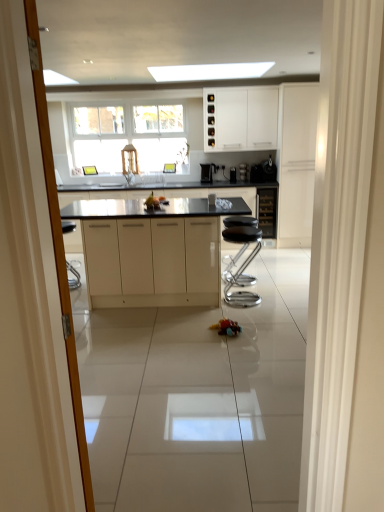
This screenshot has width=384, height=512. Identify the location of rubberized plastic toy car at center. (227, 327).

Identify the location of satin black coffee machine at center, which is the 1th coffee machine from left to right. The image size is (384, 512). (208, 172).

What do you see at coordinates (269, 170) in the screenshot? This screenshot has width=384, height=512. I see `satin black coffee machine at upper right, the third appliance positioned from the left` at bounding box center [269, 170].

Where is `metallic silver coffee machine at center, marked as the third appliance in a right-to-left arrangement`? The height and width of the screenshot is (512, 384). metallic silver coffee machine at center, marked as the third appliance in a right-to-left arrangement is located at coordinates (233, 174).

In order to face metallic silver coffee machine at center, marked as the third appliance in a right-to-left arrangement, should I rotate leftwards or rightwards?

You should look right and rotate roughly 5.714 degrees.

Measure the distance between point (248, 297) and camera.

Point (248, 297) is 13.45 feet from camera.

Measure the distance between black granite countertop at center and camera.

5.65 meters.

The height and width of the screenshot is (512, 384). Find the location of `rubberized plastic toy car at center`. rubberized plastic toy car at center is located at coordinates (227, 327).

Which is nearer, (264, 170) or (224, 231)?

Clearly, point (264, 170) is more distant from the camera than point (224, 231).

From a real-world perspective, is satin black coffee machine at upper right, which appears as the 1th appliance when viewed from the right, physically located above or below black leather stool at center?

Clearly, from a real-world perspective, satin black coffee machine at upper right, which appears as the 1th appliance when viewed from the right, is above black leather stool at center.

Is satin black coffee machine at upper right, the third appliance positioned from the left, with black leather stool at center?

No, satin black coffee machine at upper right, the third appliance positioned from the left, is not in contact with black leather stool at center.

Identify the location of bar stool below the satin black coffee machine at upper right, the third appliance positioned from the left (from the image's perspective). (241, 265).

Is black granite countertop at center not inside matte black cabinet at center, placed as the second cabinetry when sorted from left to right?

Indeed, black granite countertop at center is completely outside matte black cabinet at center, placed as the second cabinetry when sorted from left to right.

From a real-world perspective, between black granite countertop at center and matte black cabinet at center, positioned as the 2th cabinetry in right-to-left order, who is vertically higher?

matte black cabinet at center, positioned as the 2th cabinetry in right-to-left order.

From the image's perspective, is black granite countertop at center beneath matte black cabinet at center, positioned as the 2th cabinetry in right-to-left order?

Yes, from the image's perspective, black granite countertop at center is below matte black cabinet at center, positioned as the 2th cabinetry in right-to-left order.

How far apart are black granite countertop at center and matte black cabinet at center, placed as the second cabinetry when sorted from left to right?

A distance of 25.27 inches exists between black granite countertop at center and matte black cabinet at center, placed as the second cabinetry when sorted from left to right.

Is white matte cabinet at upper center, acting as the 3th cabinetry starting from the right, looking in the opposite direction of rubberized plastic toy car at center?

No, white matte cabinet at upper center, acting as the 3th cabinetry starting from the right, is not facing the opposite direction of rubberized plastic toy car at center.

Is white matte cabinet at upper center, arranged as the first cabinetry when viewed from the left, bigger or smaller than rubberized plastic toy car at center?

Clearly, white matte cabinet at upper center, arranged as the first cabinetry when viewed from the left, is larger in size than rubberized plastic toy car at center.

In the scene shown: Can you confirm if white matte cabinet at upper center, arranged as the first cabinetry when viewed from the left, is taller than rubberized plastic toy car at center?

Indeed, white matte cabinet at upper center, arranged as the first cabinetry when viewed from the left, has a greater height compared to rubberized plastic toy car at center.

Considering the sizes of objects white matte cabinet at upper center, arranged as the first cabinetry when viewed from the left, and rubberized plastic toy car at center in the image provided, who is wider, white matte cabinet at upper center, arranged as the first cabinetry when viewed from the left, or rubberized plastic toy car at center?

With larger width is white matte cabinet at upper center, arranged as the first cabinetry when viewed from the left.

Considering the relative sizes of satin black coffee machine at center, which is the 1th coffee machine from left to right, and matte black cabinet at center, positioned as the 2th cabinetry in right-to-left order, in the image provided, is satin black coffee machine at center, which is the 1th coffee machine from left to right, thinner than matte black cabinet at center, positioned as the 2th cabinetry in right-to-left order,?

Indeed, satin black coffee machine at center, which is the 1th coffee machine from left to right, has a lesser width compared to matte black cabinet at center, positioned as the 2th cabinetry in right-to-left order.

Could you tell me if satin black coffee machine at center, which is the 1th coffee machine from left to right, is facing matte black cabinet at center, placed as the second cabinetry when sorted from left to right?

No, satin black coffee machine at center, which is the 1th coffee machine from left to right, is not aimed at matte black cabinet at center, placed as the second cabinetry when sorted from left to right.

Consider the image. From the image's perspective, is satin black coffee machine at center, the 2th coffee machine positioned from the right, above matte black cabinet at center, positioned as the 2th cabinetry in right-to-left order?

Correct, satin black coffee machine at center, the 2th coffee machine positioned from the right, appears higher than matte black cabinet at center, positioned as the 2th cabinetry in right-to-left order, in the image.

Can we say satin black coffee machine at center, which is the 1th coffee machine from left to right, lies outside matte black cabinet at center, placed as the second cabinetry when sorted from left to right?

Indeed, satin black coffee machine at center, which is the 1th coffee machine from left to right, is completely outside matte black cabinet at center, placed as the second cabinetry when sorted from left to right.

Is satin black coffee machine at center, arranged as the first coffee machine when viewed from the right, at the right side of white matte cabinet at upper center, arranged as the first cabinetry when viewed from the left?

Yes, satin black coffee machine at center, arranged as the first coffee machine when viewed from the right, is to the right of white matte cabinet at upper center, arranged as the first cabinetry when viewed from the left.

Is satin black coffee machine at center, the second coffee machine in the left-to-right sequence, not close to white matte cabinet at upper center, acting as the 3th cabinetry starting from the right?

A: satin black coffee machine at center, the second coffee machine in the left-to-right sequence, is actually quite close to white matte cabinet at upper center, acting as the 3th cabinetry starting from the right.

Is satin black coffee machine at center, arranged as the first coffee machine when viewed from the right, located outside white matte cabinet at upper center, acting as the 3th cabinetry starting from the right?

Absolutely, satin black coffee machine at center, arranged as the first coffee machine when viewed from the right, is external to white matte cabinet at upper center, acting as the 3th cabinetry starting from the right.

What's the angular difference between metallic silver coffee machine at center, marked as the third appliance in a right-to-left arrangement, and satin black coffee machine at center, which is the 1th coffee machine from left to right,'s facing directions?

6.5 degrees separate the facing orientations of metallic silver coffee machine at center, marked as the third appliance in a right-to-left arrangement, and satin black coffee machine at center, which is the 1th coffee machine from left to right.

Where is `coffee machine that is on the left side of metallic silver coffee machine at center, which appears as the 1th appliance when viewed from the left`? coffee machine that is on the left side of metallic silver coffee machine at center, which appears as the 1th appliance when viewed from the left is located at coordinates (208, 172).

Which object is further away from the camera, metallic silver coffee machine at center, which appears as the 1th appliance when viewed from the left, or satin black coffee machine at center, the 2th coffee machine positioned from the right?

metallic silver coffee machine at center, which appears as the 1th appliance when viewed from the left, is further from the camera.

Is satin black coffee machine at center, the 2th coffee machine positioned from the right, a part of metallic silver coffee machine at center, marked as the third appliance in a right-to-left arrangement?

No, satin black coffee machine at center, the 2th coffee machine positioned from the right, is not a part of metallic silver coffee machine at center, marked as the third appliance in a right-to-left arrangement.

Measure the distance from white matte cabinet at right, the first cabinetry viewed from the right, to satin black coffee machine at center, the 2th coffee machine positioned from the right.

white matte cabinet at right, the first cabinetry viewed from the right, and satin black coffee machine at center, the 2th coffee machine positioned from the right, are 1.21 meters apart from each other.

Is white matte cabinet at right, which is counted as the third cabinetry, starting from the left, facing towards satin black coffee machine at center, which is the 1th coffee machine from left to right?

No, white matte cabinet at right, which is counted as the third cabinetry, starting from the left, is not facing towards satin black coffee machine at center, which is the 1th coffee machine from left to right.

Which object is positioned more to the right, white matte cabinet at right, which is counted as the third cabinetry, starting from the left, or satin black coffee machine at center, which is the 1th coffee machine from left to right?

From the viewer's perspective, white matte cabinet at right, which is counted as the third cabinetry, starting from the left, appears more on the right side.

The width and height of the screenshot is (384, 512). In order to click on bar stool that is on the left side of satin black coffee machine at upper right, which appears as the 1th appliance when viewed from the right in this screenshot , I will do `click(241, 265)`.

You are a GUI agent. You are given a task and a screenshot of the screen. Output one action in this format:
    pyautogui.click(x=<x>, y=<y>)
    Task: Click on the countertop in front of the matte black cabinet at center, placed as the second cabinetry when sorted from left to right
    The image size is (384, 512).
    Given the screenshot: What is the action you would take?
    pyautogui.click(x=235, y=196)

Which object lies nearer to the anchor point white matte cabinet at right, the first cabinetry viewed from the right, metallic silver coffee machine at center, which appears as the 1th appliance when viewed from the left, or satin black coffee machine at center, the 2th coffee machine positioned from the right?

metallic silver coffee machine at center, which appears as the 1th appliance when viewed from the left.

In the scene shown: When comparing their distances from white matte cabinet at upper center, arranged as the first cabinetry when viewed from the left, does black glossy countertop at center or satin black coffee machine at center, arranged as the first coffee machine when viewed from the right, seem further?

black glossy countertop at center is further to white matte cabinet at upper center, arranged as the first cabinetry when viewed from the left.

Based on their spatial positions, is satin black coffee maker at center, the second appliance from the right, or white matte cabinet at upper center, arranged as the first cabinetry when viewed from the left, closer to satin black coffee machine at center, arranged as the first coffee machine when viewed from the right?

satin black coffee maker at center, the second appliance from the right.

Looking at the image, which one is located closer to black leather stool at center, white matte cabinet at right, the first cabinetry viewed from the right, or satin black coffee machine at center, the 2th coffee machine positioned from the right?

white matte cabinet at right, the first cabinetry viewed from the right, lies closer to black leather stool at center than the other object.

Estimate the real-world distances between objects in this image. Which object is closer to white matte cabinet at right, the first cabinetry viewed from the right, satin black coffee machine at center, the second coffee machine in the left-to-right sequence, or metallic silver coffee machine at center, marked as the third appliance in a right-to-left arrangement?

satin black coffee machine at center, the second coffee machine in the left-to-right sequence.

When comparing their distances from satin black coffee machine at center, arranged as the first coffee machine when viewed from the right, does satin black coffee maker at center, placed as the second appliance when sorted from left to right, or matte black cabinet at center, positioned as the 2th cabinetry in right-to-left order, seem further?

matte black cabinet at center, positioned as the 2th cabinetry in right-to-left order, lies further to satin black coffee machine at center, arranged as the first coffee machine when viewed from the right, than the other object.

Considering their positions, is rubberized plastic toy car at center positioned closer to metallic silver coffee machine at center, marked as the third appliance in a right-to-left arrangement, than black leather stool at center?

black leather stool at center is closer to metallic silver coffee machine at center, marked as the third appliance in a right-to-left arrangement.

Which object lies further to the anchor point metallic silver coffee machine at center, which appears as the 1th appliance when viewed from the left, satin black coffee machine at center, which is the 1th coffee machine from left to right, or satin black coffee machine at center, arranged as the first coffee machine when viewed from the right?

satin black coffee machine at center, which is the 1th coffee machine from left to right, lies further to metallic silver coffee machine at center, which appears as the 1th appliance when viewed from the left, than the other object.

At what (x,y) coordinates should I click in order to perform the action: click on bar stool between black glossy countertop at center and satin black coffee machine at upper right, which appears as the 1th appliance when viewed from the right, in the front-back direction. Please return your answer as a coordinate pair (x, y). Looking at the image, I should click on (241, 265).

You are a GUI agent. You are given a task and a screenshot of the screen. Output one action in this format:
    pyautogui.click(x=<x>, y=<y>)
    Task: Click on the coffee machine situated between satin black coffee machine at center, which is the 1th coffee machine from left to right, and matte black cabinet at center, placed as the second cabinetry when sorted from left to right, from left to right
    This screenshot has width=384, height=512.
    Given the screenshot: What is the action you would take?
    pos(243,170)

Where is `appliance located between black glossy countertop at center and black granite countertop at center in the depth direction`? Image resolution: width=384 pixels, height=512 pixels. appliance located between black glossy countertop at center and black granite countertop at center in the depth direction is located at coordinates (269, 170).

You are a GUI agent. You are given a task and a screenshot of the screen. Output one action in this format:
    pyautogui.click(x=<x>, y=<y>)
    Task: Click on the appliance between satin black coffee machine at center, which is the 1th coffee machine from left to right, and satin black coffee maker at center, placed as the second appliance when sorted from left to right, from left to right
    This screenshot has width=384, height=512.
    Given the screenshot: What is the action you would take?
    pyautogui.click(x=233, y=174)